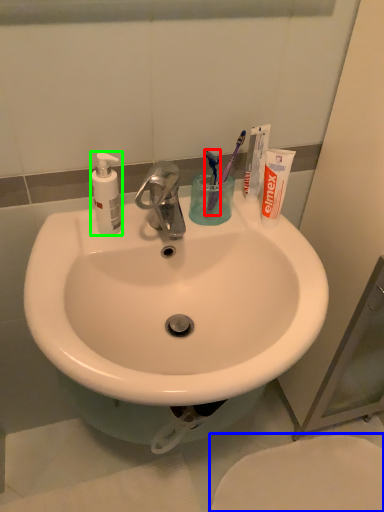
Question: Which object is positioned farthest from toothbrush (highlighted by a red box)? Select from toilet (highlighted by a blue box) and soap dispenser (highlighted by a green box).

Choices:
 (A) toilet
 (B) soap dispenser

Answer: (A)